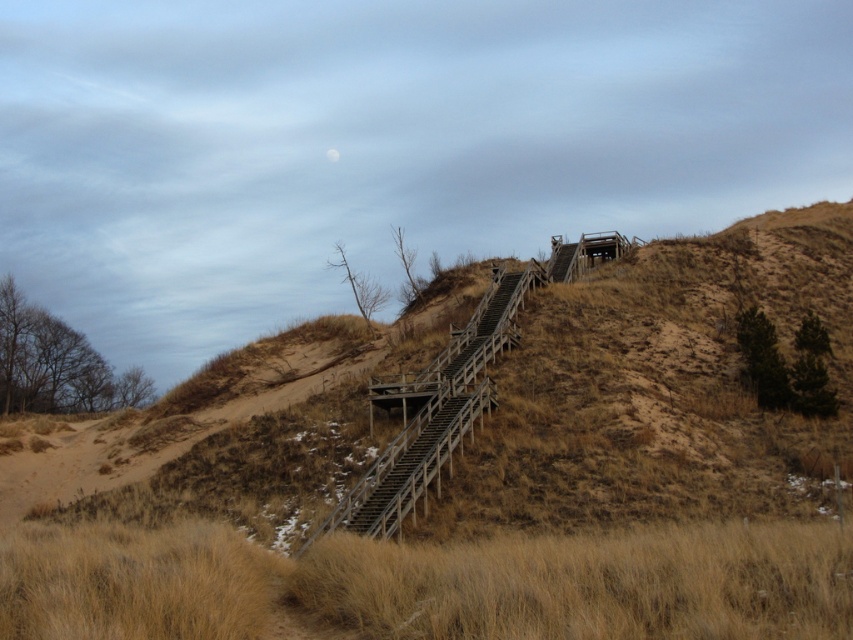
You are a hiker trying to reach the top of the sandy hill. You see the brown wooden stairs at center and dry grass at lower center. Which object is closer to you as you start your climb?

The dry grass at lower center is behind the brown wooden stairs at center, so the brown wooden stairs at center is closer to you as you start your climb.

You are hiking up the sandy hill and see the brown wooden stairs at center and the dry grass at lower center. Which object is located to the right side of the other?

The brown wooden stairs at center are to the right of dry grass at lower center.